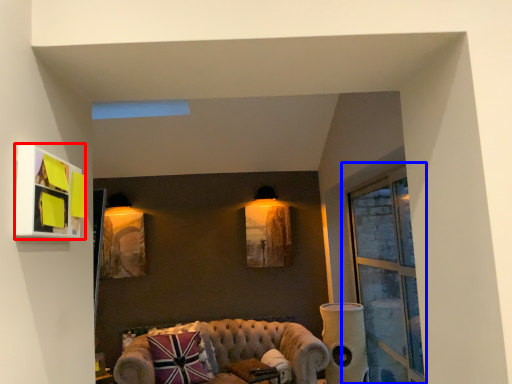
Question: Which of the following is the farthest to the observer, picture frame (highlighted by a red box) or window (highlighted by a blue box)?

Choices:
 (A) picture frame
 (B) window

Answer: (B)